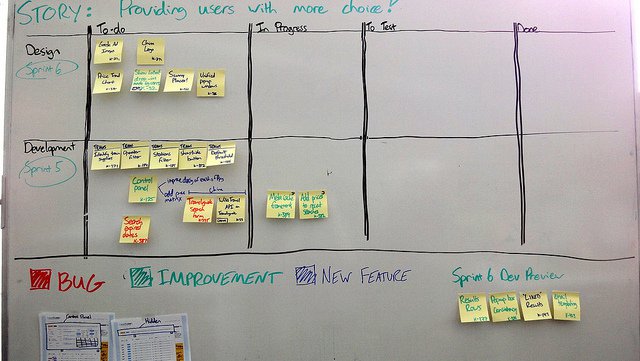
Locate an element on the screen. This screenshot has width=640, height=361. whiteboard is located at coordinates (440, 196).